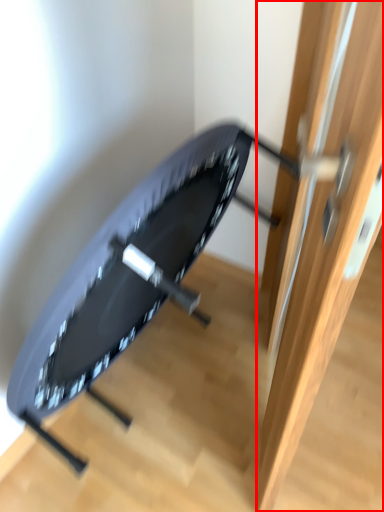
Question: From the image's perspective, what is the correct spatial relationship of door (annotated by the red box) in relation to swivel chair?

Choices:
 (A) above
 (B) below

Answer: (A)